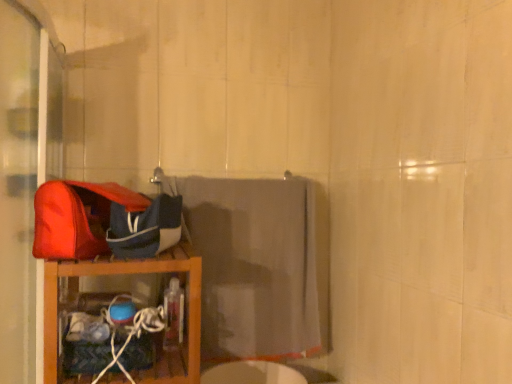
This screenshot has width=512, height=384. What do you see at coordinates (145, 228) in the screenshot?
I see `blue fabric bag at left` at bounding box center [145, 228].

In order to face matte red shoulder bag at left, should I rotate leftwards or rightwards?

Rotate your view left by about 20.024°.

Locate an element on the screen. The width and height of the screenshot is (512, 384). matte red shoulder bag at left is located at coordinates (78, 217).

Identify the location of blue fabric bag at left. The image size is (512, 384). (145, 228).

From a real-world perspective, between wooden shelf at left and blue fabric bag at left, who is vertically lower?

wooden shelf at left.

Locate an element on the screen. The image size is (512, 384). kit positioned vertically above the wooden shelf at left (from a real-world perspective) is located at coordinates (145, 228).

Is wooden shelf at left not within blue fabric bag at left?

wooden shelf at left lies outside blue fabric bag at left's area.

In the scene shown: Considering the sizes of wooden shelf at left and blue fabric bag at left in the image, is wooden shelf at left bigger or smaller than blue fabric bag at left?

Considering their sizes, wooden shelf at left takes up more space than blue fabric bag at left.

Is blue fabric bag at left to the right of gray fabric towel at center from the viewer's perspective?

No, blue fabric bag at left is not to the right of gray fabric towel at center.

Consider the image. Which object is thinner, blue fabric bag at left or gray fabric towel at center?

gray fabric towel at center.

From a real-world perspective, which object rests below the other?

gray fabric towel at center.

Between gray fabric towel at center and blue fabric bag at left, which one has smaller width?

gray fabric towel at center.

From the image's perspective, is gray fabric towel at center under blue fabric bag at left?

Yes, from the image's perspective, gray fabric towel at center is below blue fabric bag at left.

Who is more distant, blue fabric bag at left or wooden shelf at left?

blue fabric bag at left.

Can you tell me how much blue fabric bag at left and wooden shelf at left differ in facing direction?

0.797 degrees separate the facing orientations of blue fabric bag at left and wooden shelf at left.

From the picture: Between blue fabric bag at left and wooden shelf at left, which one appears on the right side from the viewer's perspective?

blue fabric bag at left.

From the image's perspective, which one is positioned lower, blue fabric bag at left or wooden shelf at left?

wooden shelf at left, from the image's perspective.

Considering the sizes of matte red shoulder bag at left and blue fabric bag at left in the image, is matte red shoulder bag at left wider or thinner than blue fabric bag at left?

Clearly, matte red shoulder bag at left has less width compared to blue fabric bag at left.

Can you confirm if matte red shoulder bag at left is bigger than blue fabric bag at left?

No, matte red shoulder bag at left is not bigger than blue fabric bag at left.

Considering the relative positions of matte red shoulder bag at left and blue fabric bag at left in the image provided, is matte red shoulder bag at left to the left or to the right of blue fabric bag at left?

Based on their positions, matte red shoulder bag at left is located to the left of blue fabric bag at left.

From the image's perspective, is gray fabric towel at center above or below wooden shelf at left?

From the image's perspective, gray fabric towel at center appears above wooden shelf at left.

In order to click on furniture located below the gray fabric towel at center (from the image's perspective) in this screenshot , I will do `click(127, 273)`.

Is point (296, 229) farther from camera compared to point (187, 271)?

Yes, point (296, 229) is behind point (187, 271).

Does gray fabric towel at center touch wooden shelf at left?

gray fabric towel at center is not next to wooden shelf at left, and they're not touching.

Can you confirm if wooden shelf at left is smaller than matte red shoulder bag at left?

No.

Is wooden shelf at left to the left of matte red shoulder bag at left from the viewer's perspective?

No, wooden shelf at left is not to the left of matte red shoulder bag at left.

Considering the sizes of wooden shelf at left and matte red shoulder bag at left in the image, is wooden shelf at left wider or thinner than matte red shoulder bag at left?

In the image, wooden shelf at left appears to be wider than matte red shoulder bag at left.

From a real-world perspective, who is located lower, wooden shelf at left or matte red shoulder bag at left?

wooden shelf at left is physically lower.

Locate an element on the screen. kit that is on the right side of wooden shelf at left is located at coordinates (145, 228).

This screenshot has width=512, height=384. Find the location of `bath towel behind the blue fabric bag at left`. bath towel behind the blue fabric bag at left is located at coordinates (254, 265).

From the image, which object appears to be farther from blue fabric bag at left, wooden shelf at left or matte red shoulder bag at left?

wooden shelf at left.

Which object lies nearer to the anchor point wooden shelf at left, blue fabric bag at left or matte red shoulder bag at left?

blue fabric bag at left.

Considering their positions, is blue fabric bag at left positioned further to gray fabric towel at center than wooden shelf at left?

blue fabric bag at left.

Looking at the image, which one is located further to wooden shelf at left, gray fabric towel at center or blue fabric bag at left?

The object further to wooden shelf at left is gray fabric towel at center.

Considering their positions, is wooden shelf at left positioned closer to matte red shoulder bag at left than blue fabric bag at left?

blue fabric bag at left lies closer to matte red shoulder bag at left than the other object.

When comparing their distances from matte red shoulder bag at left, does wooden shelf at left or gray fabric towel at center seem closer?

wooden shelf at left is positioned closer to the anchor matte red shoulder bag at left.

Estimate the real-world distances between objects in this image. Which object is further from gray fabric towel at center, wooden shelf at left or blue fabric bag at left?

The object further to gray fabric towel at center is blue fabric bag at left.

Based on their spatial positions, is wooden shelf at left or matte red shoulder bag at left further from gray fabric towel at center?

Among the two, matte red shoulder bag at left is located further to gray fabric towel at center.

Locate an element on the screen. This screenshot has height=384, width=512. kit between matte red shoulder bag at left and wooden shelf at left from top to bottom is located at coordinates (145, 228).

In order to click on kit between wooden shelf at left and gray fabric towel at center along the z-axis in this screenshot , I will do `click(145, 228)`.

You are a GUI agent. You are given a task and a screenshot of the screen. Output one action in this format:
    pyautogui.click(x=<x>, y=<y>)
    Task: Click on the kit between matte red shoulder bag at left and gray fabric towel at center in the horizontal direction
    The height and width of the screenshot is (384, 512).
    Given the screenshot: What is the action you would take?
    click(145, 228)

The height and width of the screenshot is (384, 512). In order to click on furniture between matte red shoulder bag at left and gray fabric towel at center from left to right in this screenshot , I will do `click(127, 273)`.